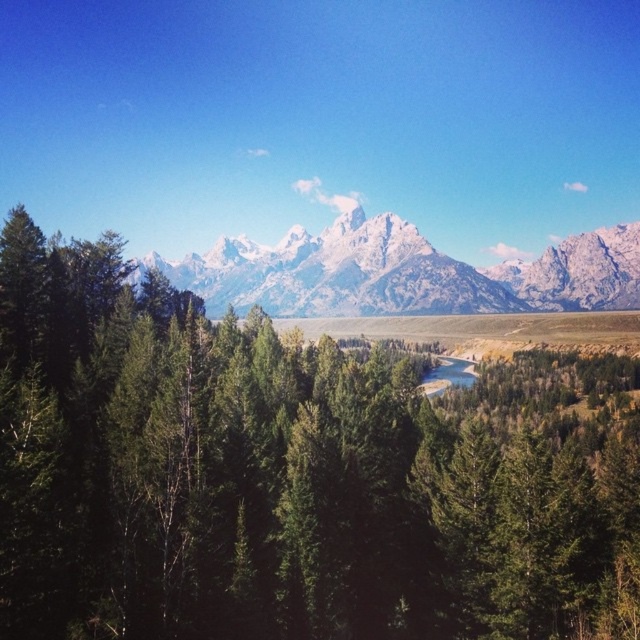
Which of these two, white snow-covered mountain range at center or clear blue water at center, stands shorter?

clear blue water at center

Can you confirm if white snow-covered mountain range at center is positioned above clear blue water at center?

Yes, white snow-covered mountain range at center is above clear blue water at center.

Between point (604, 285) and point (452, 358), which one is positioned in front?

Positioned in front is point (452, 358).

Locate an element on the screen. white snow-covered mountain range at center is located at coordinates (403, 273).

Who is shorter, green matte tree at center or white snow-covered mountain range at center?

Standing shorter between the two is green matte tree at center.

Looking at this image, which of these two, green matte tree at center or white snow-covered mountain range at center, stands taller?

white snow-covered mountain range at center is taller.

Where is `green matte tree at center`? Image resolution: width=640 pixels, height=640 pixels. green matte tree at center is located at coordinates (291, 476).

In order to click on green matte tree at center in this screenshot , I will do `click(291, 476)`.

Does green matte tree at center have a larger size compared to clear blue water at center?

Indeed, green matte tree at center has a larger size compared to clear blue water at center.

Is green matte tree at center positioned at the back of clear blue water at center?

No, green matte tree at center is closer to the viewer.

Where is `green matte tree at center`? green matte tree at center is located at coordinates (291, 476).